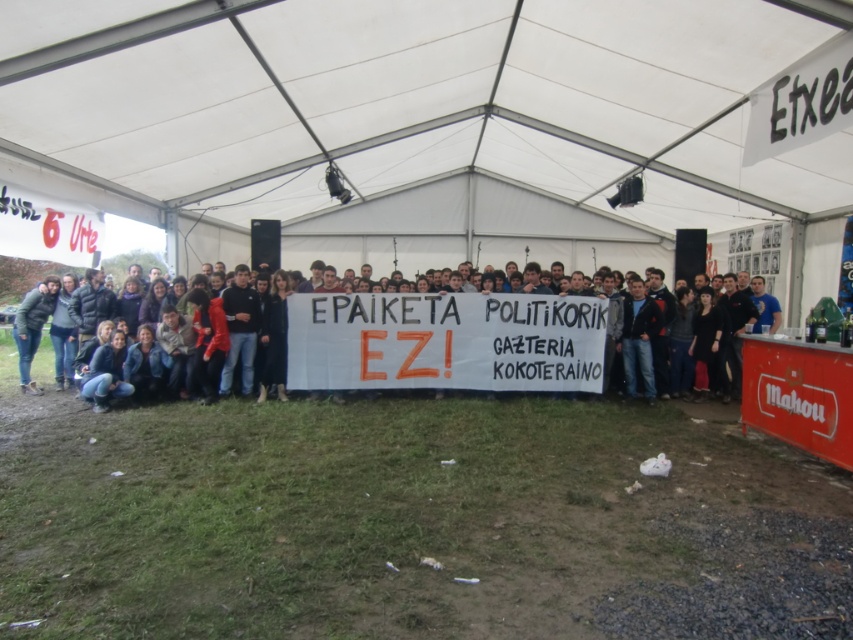
Question: Can you confirm if white fabric canopy at center is smaller than white paper banner at center?

Choices:
 (A) yes
 (B) no

Answer: (B)

Question: Which point appears closest to the camera in this image?

Choices:
 (A) (485, 316)
 (B) (515, 362)
 (C) (193, 36)

Answer: (C)

Question: Does white paper banner at center appear over dark brown leather jacket at center?

Choices:
 (A) yes
 (B) no

Answer: (A)

Question: Considering the real-world distances, which object is closest to the dark brown leather jacket at center?

Choices:
 (A) white fabric canopy at center
 (B) white paper banner at center

Answer: (B)

Question: Is white fabric canopy at center closer to camera compared to dark brown leather jacket at center?

Choices:
 (A) yes
 (B) no

Answer: (A)

Question: Which object is closer to the camera taking this photo?

Choices:
 (A) white paper banner at center
 (B) white fabric canopy at center
 (C) dark brown leather jacket at center

Answer: (B)